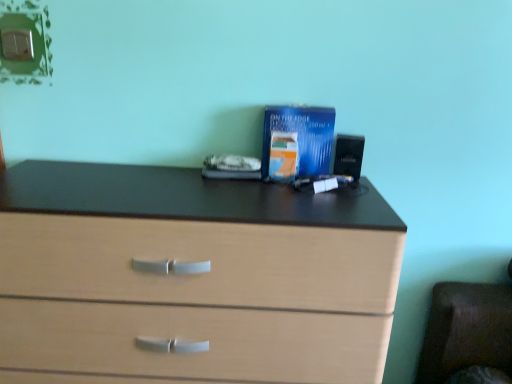
Identify the location of blue glossy paperback book at center, the first paperback book positioned from the back. The height and width of the screenshot is (384, 512). (302, 135).

Describe the element at coordinates (302, 135) in the screenshot. I see `blue glossy paperback book at center, the first paperback book positioned from the back` at that location.

What do you see at coordinates (283, 156) in the screenshot? I see `blue glossy paperback book at center, which is the 2th paperback book from back to front` at bounding box center [283, 156].

Where is `blue glossy paperback book at center, the first paperback book positioned from the front`? blue glossy paperback book at center, the first paperback book positioned from the front is located at coordinates (283, 156).

This screenshot has height=384, width=512. What do you see at coordinates (191, 277) in the screenshot? I see `light wood chest of drawers at center` at bounding box center [191, 277].

What are the coordinates of `blue glossy paperback book at center, the first paperback book positioned from the back` in the screenshot? It's located at (302, 135).

In the scene shown: Which of these two, light wood chest of drawers at center or blue glossy paperback book at center, which is the 2th paperback book from back to front, is bigger?

light wood chest of drawers at center is bigger.

From a real-world perspective, is light wood chest of drawers at center positioned under blue glossy paperback book at center, the first paperback book positioned from the front, based on gravity?

Indeed, from a real-world perspective, light wood chest of drawers at center is positioned beneath blue glossy paperback book at center, the first paperback book positioned from the front.

Can we say light wood chest of drawers at center lies outside blue glossy paperback book at center, which is the 2th paperback book from back to front?

Indeed, light wood chest of drawers at center is completely outside blue glossy paperback book at center, which is the 2th paperback book from back to front.

Considering the sizes of objects blue glossy paperback book at center, which appears as the second paperback book when viewed from the front, and light wood chest of drawers at center in the image provided, who is smaller, blue glossy paperback book at center, which appears as the second paperback book when viewed from the front, or light wood chest of drawers at center?

With smaller size is blue glossy paperback book at center, which appears as the second paperback book when viewed from the front.

Relative to light wood chest of drawers at center, is blue glossy paperback book at center, which appears as the second paperback book when viewed from the front, in front or behind?

blue glossy paperback book at center, which appears as the second paperback book when viewed from the front, is positioned farther from the viewer than light wood chest of drawers at center.

Can you confirm if blue glossy paperback book at center, which appears as the second paperback book when viewed from the front, is shorter than light wood chest of drawers at center?

Indeed, blue glossy paperback book at center, which appears as the second paperback book when viewed from the front, has a lesser height compared to light wood chest of drawers at center.

Can you see blue glossy paperback book at center, which is the 2th paperback book from back to front, touching light wood chest of drawers at center?

No, blue glossy paperback book at center, which is the 2th paperback book from back to front, is not in contact with light wood chest of drawers at center.

Would you say light wood chest of drawers at center is part of blue glossy paperback book at center, which is the 2th paperback book from back to front,'s contents?

No.

Is point (270, 155) positioned after point (387, 275)?

That is True.

At what (x,y) coordinates should I click in order to perform the action: click on the 1st paperback book above the light wood chest of drawers at center (from the image's perspective). Please return your answer as a coordinate pair (x, y). Looking at the image, I should click on (283, 156).

Does blue glossy paperback book at center, the first paperback book positioned from the back, appear on the left side of blue glossy paperback book at center, the first paperback book positioned from the front?

Incorrect, blue glossy paperback book at center, the first paperback book positioned from the back, is not on the left side of blue glossy paperback book at center, the first paperback book positioned from the front.

Is blue glossy paperback book at center, which is the 2th paperback book from back to front, at the back of blue glossy paperback book at center, the first paperback book positioned from the back?

Yes.

From the picture: From the image's perspective, would you say blue glossy paperback book at center, which appears as the second paperback book when viewed from the front, is positioned over blue glossy paperback book at center, the first paperback book positioned from the front?

Indeed, from the image's perspective, blue glossy paperback book at center, which appears as the second paperback book when viewed from the front, is shown above blue glossy paperback book at center, the first paperback book positioned from the front.

Locate an element on the screen. The height and width of the screenshot is (384, 512). paperback book positioned vertically above the blue glossy paperback book at center, the first paperback book positioned from the front (from a real-world perspective) is located at coordinates (302, 135).

How far apart are blue glossy paperback book at center, the first paperback book positioned from the front, and blue glossy paperback book at center, which appears as the second paperback book when viewed from the front?

blue glossy paperback book at center, the first paperback book positioned from the front, and blue glossy paperback book at center, which appears as the second paperback book when viewed from the front, are 1.79 inches apart.

Looking at their sizes, would you say blue glossy paperback book at center, the first paperback book positioned from the front, is wider or thinner than blue glossy paperback book at center, the first paperback book positioned from the back?

Considering their sizes, blue glossy paperback book at center, the first paperback book positioned from the front, looks slimmer than blue glossy paperback book at center, the first paperback book positioned from the back.

Considering the relative positions of blue glossy paperback book at center, the first paperback book positioned from the front, and blue glossy paperback book at center, the first paperback book positioned from the back, in the image provided, is blue glossy paperback book at center, the first paperback book positioned from the front, behind blue glossy paperback book at center, the first paperback book positioned from the back,?

No, the depth of blue glossy paperback book at center, the first paperback book positioned from the front, is less than that of blue glossy paperback book at center, the first paperback book positioned from the back.

How different are the orientations of light wood chest of drawers at center and blue glossy paperback book at center, which appears as the second paperback book when viewed from the front, in degrees?

There is a 8.28e-06-degree angle between the facing directions of light wood chest of drawers at center and blue glossy paperback book at center, which appears as the second paperback book when viewed from the front.

Is light wood chest of drawers at center positioned beyond the bounds of blue glossy paperback book at center, the first paperback book positioned from the back?

That's correct, light wood chest of drawers at center is outside of blue glossy paperback book at center, the first paperback book positioned from the back.

From the picture: How much distance is there between light wood chest of drawers at center and blue glossy paperback book at center, the first paperback book positioned from the back?

light wood chest of drawers at center and blue glossy paperback book at center, the first paperback book positioned from the back, are 15.10 inches apart from each other.

Is light wood chest of drawers at center at the right side of blue glossy paperback book at center, the first paperback book positioned from the back?

No, light wood chest of drawers at center is not to the right of blue glossy paperback book at center, the first paperback book positioned from the back.

Where is `chest of drawers in front of the blue glossy paperback book at center, which is the 2th paperback book from back to front`? Image resolution: width=512 pixels, height=384 pixels. chest of drawers in front of the blue glossy paperback book at center, which is the 2th paperback book from back to front is located at coordinates (191, 277).

Find the location of a particular element. The height and width of the screenshot is (384, 512). chest of drawers below the blue glossy paperback book at center, the first paperback book positioned from the back (from the image's perspective) is located at coordinates (191, 277).

When comparing their distances from light wood chest of drawers at center, does blue glossy paperback book at center, which appears as the second paperback book when viewed from the front, or blue glossy paperback book at center, the first paperback book positioned from the front, seem further?

blue glossy paperback book at center, the first paperback book positioned from the front, is further to light wood chest of drawers at center.

When comparing their distances from light wood chest of drawers at center, does blue glossy paperback book at center, which is the 2th paperback book from back to front, or blue glossy paperback book at center, the first paperback book positioned from the back, seem further?

blue glossy paperback book at center, which is the 2th paperback book from back to front, is further to light wood chest of drawers at center.

From the image, which object appears to be farther from blue glossy paperback book at center, the first paperback book positioned from the back, blue glossy paperback book at center, which is the 2th paperback book from back to front, or light wood chest of drawers at center?

light wood chest of drawers at center.

Considering their positions, is light wood chest of drawers at center positioned further to blue glossy paperback book at center, the first paperback book positioned from the front, than blue glossy paperback book at center, the first paperback book positioned from the back?

light wood chest of drawers at center.

Estimate the real-world distances between objects in this image. Which object is further from blue glossy paperback book at center, the first paperback book positioned from the back, light wood chest of drawers at center or blue glossy paperback book at center, which is the 2th paperback book from back to front?

light wood chest of drawers at center.

When comparing their distances from blue glossy paperback book at center, which is the 2th paperback book from back to front, does blue glossy paperback book at center, the first paperback book positioned from the back, or light wood chest of drawers at center seem closer?

blue glossy paperback book at center, the first paperback book positioned from the back, lies closer to blue glossy paperback book at center, which is the 2th paperback book from back to front, than the other object.

Locate an element on the screen. The height and width of the screenshot is (384, 512). paperback book between blue glossy paperback book at center, which appears as the second paperback book when viewed from the front, and light wood chest of drawers at center, in the vertical direction is located at coordinates (283, 156).